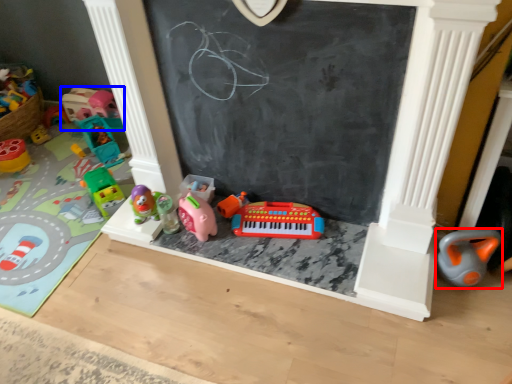
Question: Which of the following is the farthest to the observer, toy (highlighted by a red box) or toy (highlighted by a blue box)?

Choices:
 (A) toy
 (B) toy

Answer: (B)